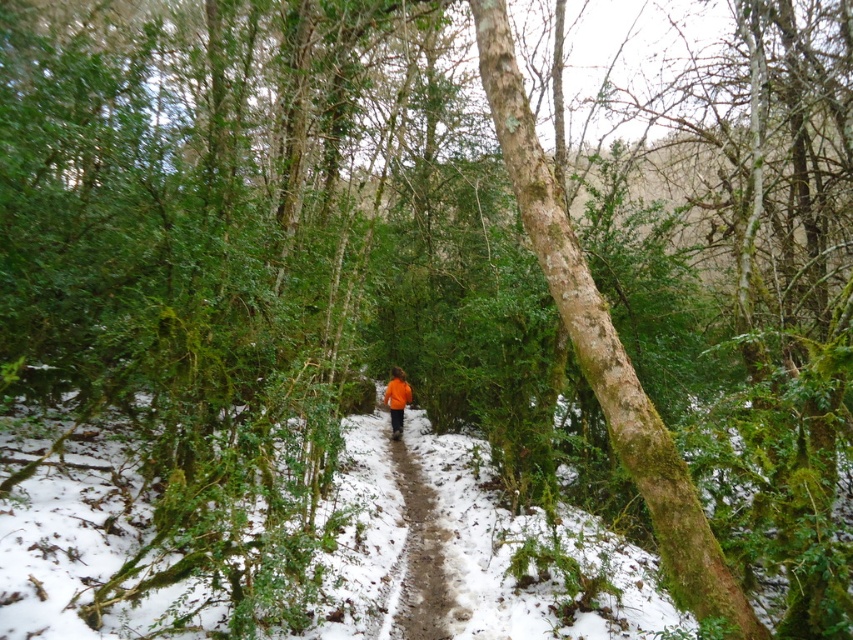
Question: Which object is farther from the camera taking this photo?

Choices:
 (A) green mossy bark tree at center
 (B) orange fabric jacket at center

Answer: (B)

Question: Which object appears farthest from the camera in this image?

Choices:
 (A) orange fabric at center
 (B) orange fabric jacket at center

Answer: (B)

Question: Considering the relative positions of orange fabric at center and orange fabric jacket at center in the image provided, where is orange fabric at center located with respect to orange fabric jacket at center?

Choices:
 (A) left
 (B) right

Answer: (B)

Question: Does green mossy bark tree at center appear over orange fabric jacket at center?

Choices:
 (A) yes
 (B) no

Answer: (A)

Question: Which point is closer to the camera taking this photo?

Choices:
 (A) (402, 403)
 (B) (601, 381)

Answer: (B)

Question: Can you confirm if green mossy bark tree at center is thinner than orange fabric jacket at center?

Choices:
 (A) yes
 (B) no

Answer: (B)